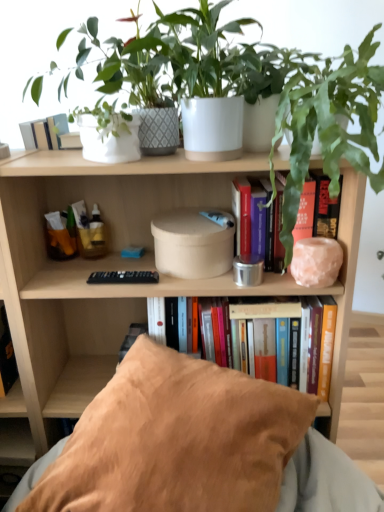
Question: Does beige fabric pillow at lower center have a lesser height compared to white ceramic pot at upper center, which appears as the 2th houseplant when viewed from the right?

Choices:
 (A) no
 (B) yes

Answer: (B)

Question: From the image's perspective, would you say beige fabric pillow at lower center is shown under white ceramic pot at upper center, placed as the 1th houseplant when sorted from left to right?

Choices:
 (A) yes
 (B) no

Answer: (A)

Question: Does beige fabric pillow at lower center come in front of white ceramic pot at upper center, placed as the 1th houseplant when sorted from left to right?

Choices:
 (A) no
 (B) yes

Answer: (B)

Question: Is beige fabric pillow at lower center not within white ceramic pot at upper center, placed as the 1th houseplant when sorted from left to right?

Choices:
 (A) yes
 (B) no

Answer: (A)

Question: Does beige fabric pillow at lower center lie behind white ceramic pot at upper center, which appears as the 2th houseplant when viewed from the right?

Choices:
 (A) no
 (B) yes

Answer: (A)

Question: Is white ceramic pot at upper center, placed as the 1th houseplant when sorted from left to right, taller or shorter than beige fabric pillow at lower center?

Choices:
 (A) tall
 (B) short

Answer: (A)

Question: Is white ceramic pot at upper center, placed as the 1th houseplant when sorted from left to right, wider or thinner than beige fabric pillow at lower center?

Choices:
 (A) thin
 (B) wide

Answer: (A)

Question: From a real-world perspective, relative to beige fabric pillow at lower center, is white ceramic pot at upper center, placed as the 1th houseplant when sorted from left to right, vertically above or below?

Choices:
 (A) above
 (B) below

Answer: (A)

Question: Would you say white ceramic pot at upper center, placed as the 1th houseplant when sorted from left to right, is inside or outside beige fabric pillow at lower center?

Choices:
 (A) outside
 (B) inside

Answer: (A)

Question: In the image, is hardcover book at center, placed as the 2th book when sorted from bottom to top, positioned in front of or behind beige fabric pillow at lower center?

Choices:
 (A) front
 (B) behind

Answer: (B)

Question: Looking at the image, does hardcover book at center, placed as the 2th book when sorted from bottom to top, seem bigger or smaller compared to beige fabric pillow at lower center?

Choices:
 (A) small
 (B) big

Answer: (A)

Question: From a real-world perspective, is hardcover book at center, placed as the 2th book when sorted from bottom to top, physically located above or below beige fabric pillow at lower center?

Choices:
 (A) below
 (B) above

Answer: (B)

Question: Considering the positions of hardcover book at center, placed as the 2th book when sorted from bottom to top, and beige fabric pillow at lower center in the image, is hardcover book at center, placed as the 2th book when sorted from bottom to top, taller or shorter than beige fabric pillow at lower center?

Choices:
 (A) short
 (B) tall

Answer: (A)

Question: Is green leafy plant at upper right, which is counted as the second houseplant, starting from the left, situated inside beige fabric pillow at lower center or outside?

Choices:
 (A) inside
 (B) outside

Answer: (B)

Question: Considering the positions of point (329, 182) and point (248, 490), is point (329, 182) closer or farther from the camera than point (248, 490)?

Choices:
 (A) farther
 (B) closer

Answer: (A)